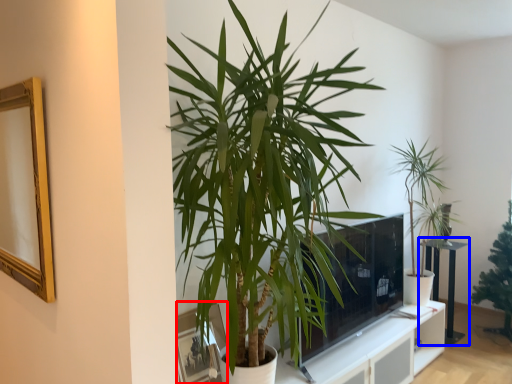
Question: Which point is closer to the camera, picture frame (highlighted by a red box) or table (highlighted by a blue box)?

Choices:
 (A) picture frame
 (B) table

Answer: (A)